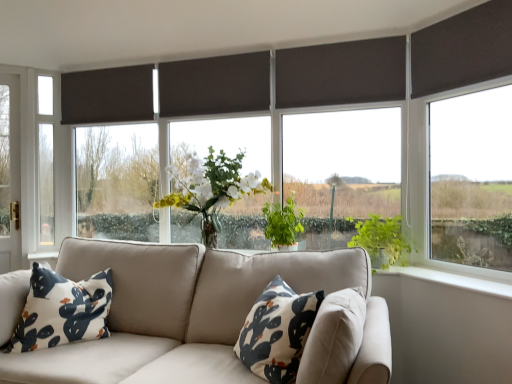
Question: From a real-world perspective, is dark matte blind at center, which is the third window in left-to-right order, positioned above or below matte black curtain at upper left, which is the second curtain from front to back?

Choices:
 (A) above
 (B) below

Answer: (B)

Question: Is dark matte blind at center, the second window when ordered from front to back, situated inside matte black curtain at upper left, the 1th curtain viewed from the left, or outside?

Choices:
 (A) inside
 (B) outside

Answer: (B)

Question: Which object is the closest to the white fabric pillow at center, the first pillow when ordered from right to left?

Choices:
 (A) green leafy plant at center, which ranks as the 2th vegetation in right-to-left order
 (B) white fabric pillow at lower left, arranged as the second pillow when viewed from the right
 (C) dark grey fabric at upper center, which is the 2th curtain in back-to-front order
 (D) dark brown fabric blind at upper right
 (E) clear glass window at left, placed as the 1th window when sorted from left to right

Answer: (A)

Question: Estimate the real-world distances between objects in this image. Which object is closer to the dark brown fabric blind at upper right?

Choices:
 (A) matte glass window at center, which is the third window from front to back
 (B) matte black curtain at upper left, which ranks as the second curtain in right-to-left order
 (C) dark fabric window at upper right, which appears as the fourth window when viewed from the back
 (D) green leafy tree at left
 (E) dark matte blind at center, the second window in the right-to-left sequence

Answer: (C)